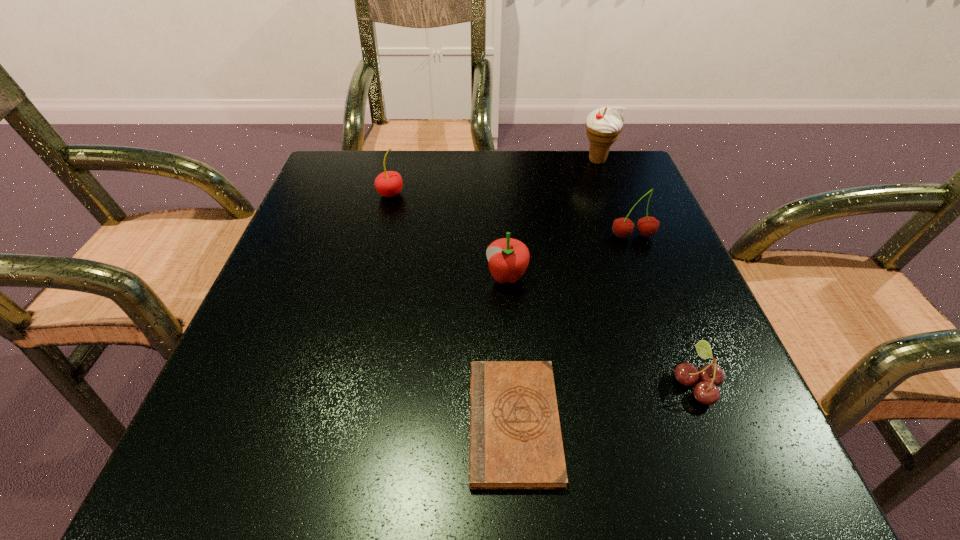
This screenshot has height=540, width=960. In order to click on free spot between the second farthest cherry and the icecream in this screenshot , I will do `click(614, 198)`.

The image size is (960, 540). I want to click on free space between the diary and the farthest object, so click(x=556, y=292).

Identify the location of vacant area that lies between the fourth farthest object and the diary. (511, 350).

Where is `free space between the fifth nearest object and the shortest object`? free space between the fifth nearest object and the shortest object is located at coordinates (452, 308).

The image size is (960, 540). I want to click on free space that is in between the fourth nearest object and the leftmost object, so click(512, 215).

Identify which object is the third closest to the second shortest object. Please provide its 2D coordinates. Your answer should be formatted as a tuple, i.e. [(x, y)], where the tuple contains the x and y coordinates of a point satisfying the conditions above.

[(647, 226)]

Identify which object is the fifth nearest to the fifth tallest object. Please provide its 2D coordinates. Your answer should be formatted as a tuple, i.e. [(x, y)], where the tuple contains the x and y coordinates of a point satisfying the conditions above.

[(389, 183)]

Where is `cherry that is the second closest to the third shortest object`? The image size is (960, 540). cherry that is the second closest to the third shortest object is located at coordinates (711, 376).

Locate which cherry ranks in proximity to the apple. Please provide its 2D coordinates. Your answer should be formatted as a tuple, i.e. [(x, y)], where the tuple contains the x and y coordinates of a point satisfying the conditions above.

[(647, 226)]

In order to click on free location that satisfies the following two spatial constraints: 1. on the front side of the farthest cherry; 2. on the right side of the third shortest object in this screenshot , I will do `click(370, 276)`.